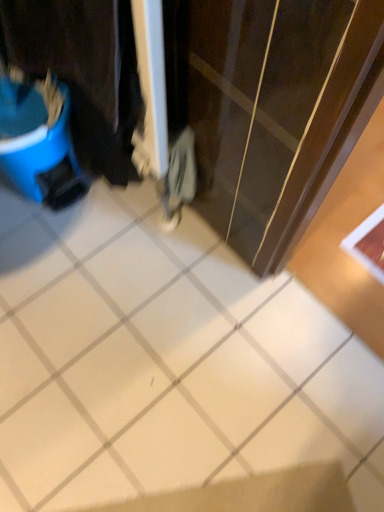
Question: Is blue plastic bucket at left positioned with its back to white glossy tile at center?

Choices:
 (A) yes
 (B) no

Answer: (B)

Question: Does blue plastic bucket at left have a greater width compared to white glossy tile at center?

Choices:
 (A) yes
 (B) no

Answer: (B)

Question: Is blue plastic bucket at left oriented towards white glossy tile at center?

Choices:
 (A) yes
 (B) no

Answer: (B)

Question: Does blue plastic bucket at left have a greater height compared to white glossy tile at center?

Choices:
 (A) no
 (B) yes

Answer: (B)

Question: From a real-world perspective, is blue plastic bucket at left below white glossy tile at center?

Choices:
 (A) no
 (B) yes

Answer: (A)

Question: Are blue plastic bucket at left and white glossy tile at center located far from each other?

Choices:
 (A) no
 (B) yes

Answer: (A)

Question: Is blue plastic bucket at left a part of white glossy tile at center?

Choices:
 (A) yes
 (B) no

Answer: (B)

Question: Is white glossy tile at center aimed at blue plastic bucket at left?

Choices:
 (A) no
 (B) yes

Answer: (A)

Question: From a real-world perspective, is white glossy tile at center positioned over blue plastic bucket at left based on gravity?

Choices:
 (A) yes
 (B) no

Answer: (B)

Question: Are white glossy tile at center and blue plastic bucket at left beside each other?

Choices:
 (A) no
 (B) yes

Answer: (A)

Question: Is white glossy tile at center positioned far away from blue plastic bucket at left?

Choices:
 (A) no
 (B) yes

Answer: (A)

Question: Is white glossy tile at center facing away from blue plastic bucket at left?

Choices:
 (A) yes
 (B) no

Answer: (B)

Question: Relative to white glossy tile at center, is blue plastic bucket at left in front or behind?

Choices:
 (A) behind
 (B) front

Answer: (A)